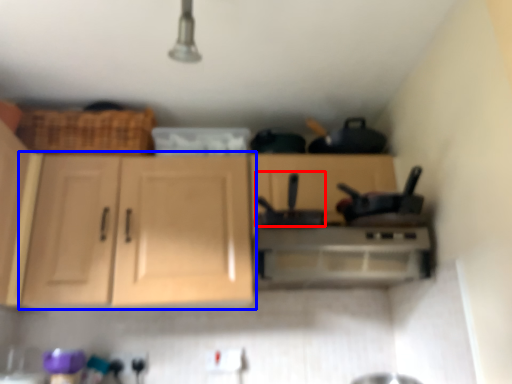
Question: Among these objects, which one is nearest to the camera, appliance (highlighted by a red box) or cabinetry (highlighted by a blue box)?

Choices:
 (A) appliance
 (B) cabinetry

Answer: (A)